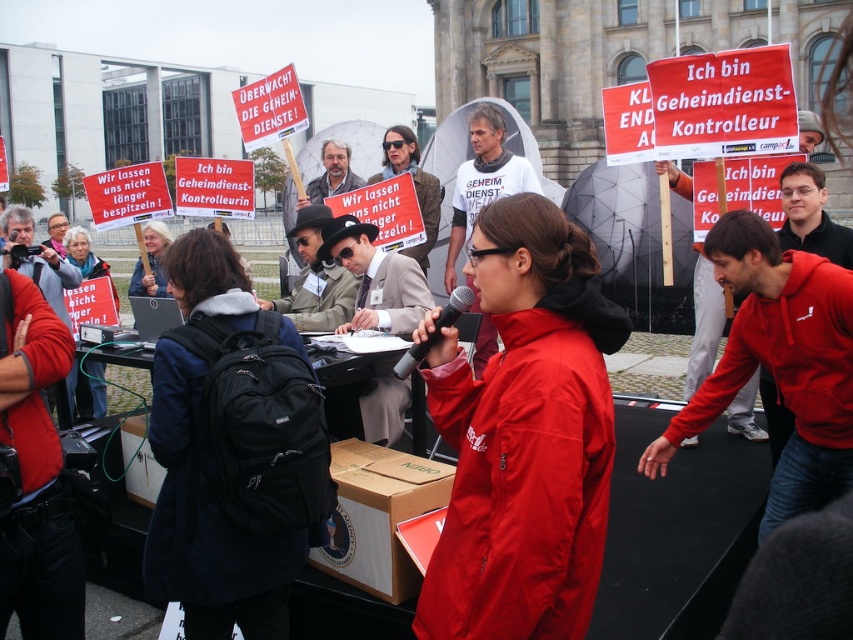
You are a photographer positioned at the back of the crowd. You want to take a photo of the matte black jacket at center without the black fabric backpack at center blocking the view. Is it possible to do so by moving to the side?

The black fabric backpack at center is in front of matte black jacket at center, so moving to the side might allow you to position yourself where the backpack is no longer directly blocking the jacket, making it possible to take the photo without obstruction.

You are a photographer positioned at the edge of the demonstration. You need to capture a photo that includes both the red matte jacket at center and the black fabric backpack at center. Given that your camera has a maximum zoom range of 10 meters, will you be able to fit both subjects into the frame without moving closer?

The distance between the red matte jacket at center and the black fabric backpack at center is 10.14 meters. Since the camera can only zoom up to 10 meters, the photographer will not be able to fit both subjects into the frame without moving closer.

You are standing in the crowd observing the demonstration. There are two points marked in the scene. Which point is closer to you, point (293, 340) or point (74, 413)?

Point (293, 340) is closer to the viewer than point (74, 413).